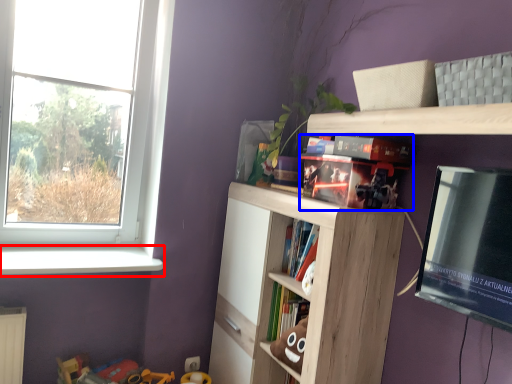
Question: Which of the following is the closest to the observer, window sill (highlighted by a red box) or book (highlighted by a blue box)?

Choices:
 (A) window sill
 (B) book

Answer: (B)